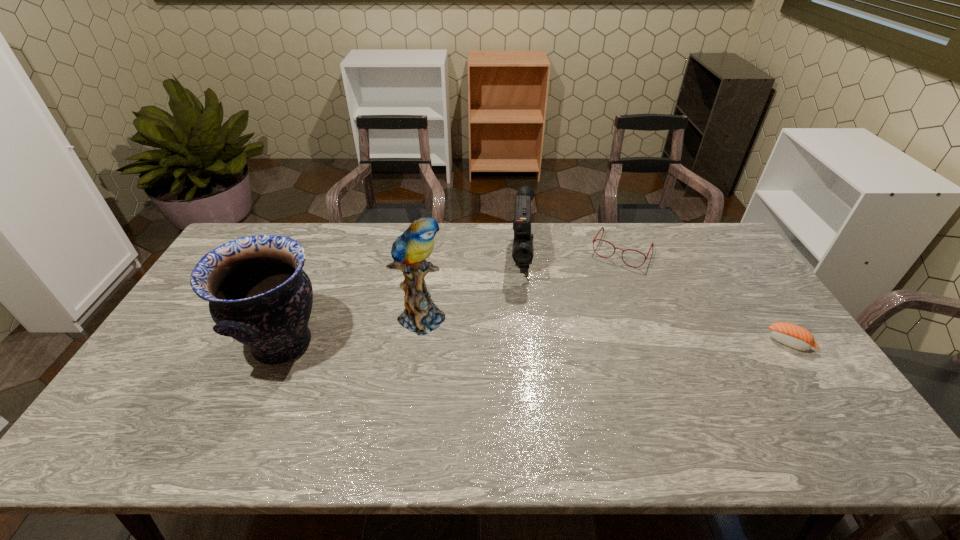
In the image, there is a desktop. Where is `vacant space at the right edge`? The width and height of the screenshot is (960, 540). vacant space at the right edge is located at coordinates (775, 352).

The height and width of the screenshot is (540, 960). In order to click on vacant space at the far right corner in this screenshot , I will do `click(675, 226)`.

The image size is (960, 540). I want to click on free space between the camcorder and the sushi, so click(x=656, y=300).

Locate an element on the screen. free space between the fourth tallest object and the fourth object from right to left is located at coordinates (522, 282).

Find the location of a particular element. empty location between the shortest object and the camcorder is located at coordinates (656, 300).

Locate an element on the screen. The width and height of the screenshot is (960, 540). free spot between the pottery and the spectacles is located at coordinates (452, 297).

I want to click on free space between the parrot and the fourth shortest object, so click(x=353, y=329).

You are a GUI agent. You are given a task and a screenshot of the screen. Output one action in this format:
    pyautogui.click(x=<x>, y=<y>)
    Task: Click on the free space between the second object from left to right and the camcorder
    
    Given the screenshot: What is the action you would take?
    pyautogui.click(x=472, y=286)

Where is `vacant region between the rightmost object and the fourth shortest object`? The width and height of the screenshot is (960, 540). vacant region between the rightmost object and the fourth shortest object is located at coordinates (537, 343).

Find the location of a particular element. blank region between the camcorder and the shortest object is located at coordinates (656, 300).